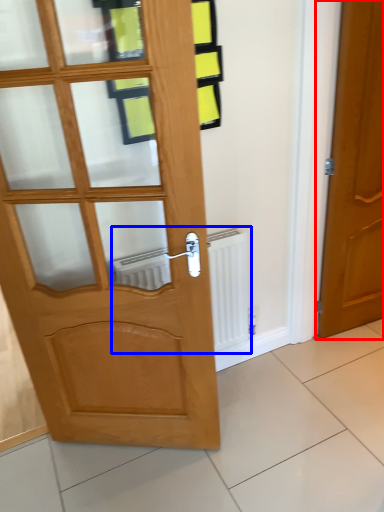
Question: Among these objects, which one is farthest to the camera, door (highlighted by a red box) or radiator (highlighted by a blue box)?

Choices:
 (A) door
 (B) radiator

Answer: (B)